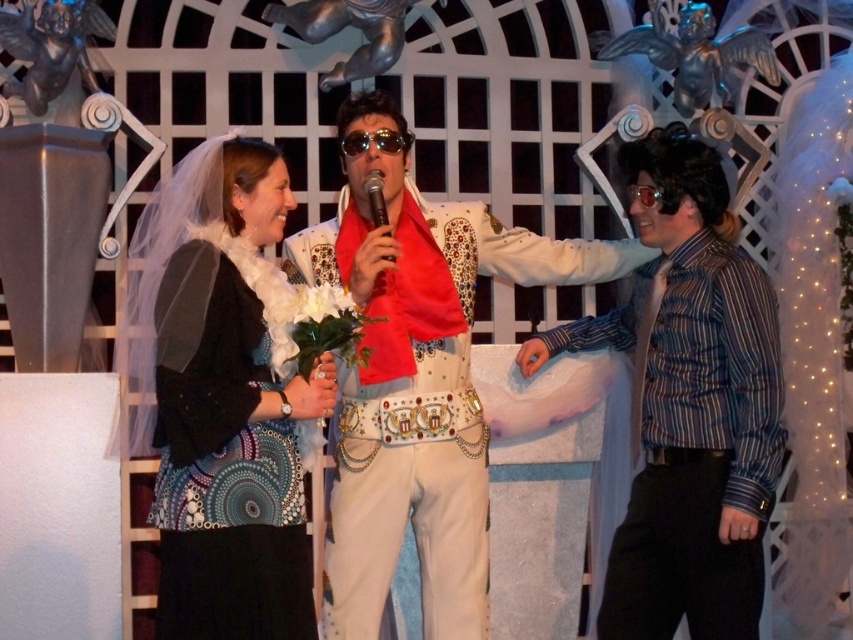
Looking at this image, you are an event planner arranging a photoshoot for a themed event. You need to position the matte black dress at center and the striped shirt at right in a way that maintains their original positions relative to each other as shown in the image. Which object should be placed lower to ensure they are arranged correctly?

The matte black dress at center should be placed lower than the striped shirt at right to maintain their original positions as shown in the image.

You are a photographer positioned in front of the stage. You need to capture a photo that includes both the matte black dress at center and the striped shirt at right. Which object will appear closer to the camera in the photo?

The matte black dress at center will appear closer to the camera in the photo because it is further to the viewer than the striped shirt at right.

Based on the photo, you are an event planner arranging a themed party. You need to place a large centerpiece on the table between the striped shirt at right and the black textured dress at center. Based on their positions, where should you place the centerpiece so it is equidistant from both?

The striped shirt at right is located below the black textured dress at center, so placing the centerpiece directly between them horizontally would ensure it is equidistant from both.